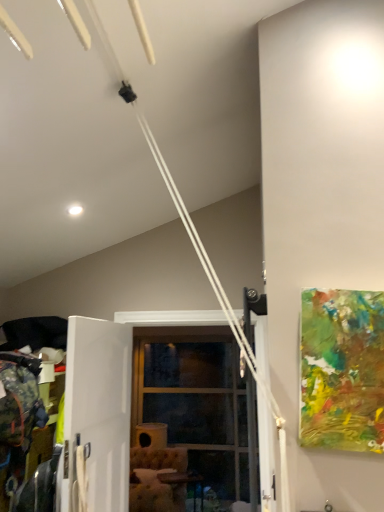
What do you see at coordinates (183, 481) in the screenshot?
I see `wooden table at lower center` at bounding box center [183, 481].

The image size is (384, 512). Find the location of `white matte screen door at center`. white matte screen door at center is located at coordinates (98, 411).

From the picture: Measure the distance between point (x=103, y=475) and camera.

Point (x=103, y=475) is 6.77 feet from camera.

Where is `wooden table at lower center`? This screenshot has width=384, height=512. wooden table at lower center is located at coordinates tap(183, 481).

Can you confirm if wooden table at lower center is taller than white matte screen door at center?

Incorrect, the height of wooden table at lower center is not larger of that of white matte screen door at center.

Is wooden table at lower center to the right of white matte screen door at center from the viewer's perspective?

Correct, you'll find wooden table at lower center to the right of white matte screen door at center.

Can you confirm if wooden table at lower center is thinner than white matte screen door at center?

No.

Is white matte screen door at center completely or partially inside wooden table at lower center?

Definitely not — white matte screen door at center is not inside wooden table at lower center.

Which object is more forward, clear glass door at center or abstract painting at right?

abstract painting at right is closer to the camera.

Is clear glass door at center bigger or smaller than abstract painting at right?

In the image, clear glass door at center appears to be larger than abstract painting at right.

Is clear glass door at center looking in the opposite direction of abstract painting at right?

No, clear glass door at center is not facing the opposite direction of abstract painting at right.

Is abstract painting at right far away from wooden table at lower center?

Yes, abstract painting at right and wooden table at lower center are located far from each other.

Is abstract painting at right not inside wooden table at lower center?

abstract painting at right is positioned outside wooden table at lower center.

Which of these two, abstract painting at right or wooden table at lower center, is thinner?

abstract painting at right.

Between abstract painting at right and wooden table at lower center, which one has less height?

Standing shorter between the two is abstract painting at right.

Is abstract painting at right spatially inside white matte screen door at center, or outside of it?

abstract painting at right is not enclosed by white matte screen door at center.

This screenshot has height=512, width=384. I want to click on screen door that is under the abstract painting at right (from a real-world perspective), so click(98, 411).

Is abstract painting at right bigger than white matte screen door at center?

Incorrect, abstract painting at right is not larger than white matte screen door at center.

Is abstract painting at right behind white matte screen door at center?

No, abstract painting at right is in front of white matte screen door at center.

Is abstract painting at right situated inside clear glass door at center or outside?

The correct answer is: outside.

Which object is thinner, abstract painting at right or clear glass door at center?

abstract painting at right is thinner.

Where is `picture frame in front of the clear glass door at center`? The width and height of the screenshot is (384, 512). picture frame in front of the clear glass door at center is located at coordinates (342, 370).

Which object is positioned more to the right, abstract painting at right or clear glass door at center?

From the viewer's perspective, abstract painting at right appears more on the right side.

Between point (117, 451) and point (132, 401), which one is positioned in front?

The point (117, 451) is in front.

Is white matte screen door at center touching clear glass door at center?

No, white matte screen door at center is not with clear glass door at center.

From their relative heights in the image, would you say white matte screen door at center is taller or shorter than clear glass door at center?

Clearly, white matte screen door at center is shorter compared to clear glass door at center.

From the image's perspective, relative to clear glass door at center, is white matte screen door at center above or below?

Clearly, from the image's perspective, white matte screen door at center is above clear glass door at center.

Is clear glass door at center outside of white matte screen door at center?

Yes, clear glass door at center is not within white matte screen door at center.

Considering the sizes of objects clear glass door at center and white matte screen door at center in the image provided, who is shorter, clear glass door at center or white matte screen door at center?

white matte screen door at center is shorter.

Consider the image. How far apart are clear glass door at center and white matte screen door at center?

clear glass door at center is 2.21 meters from white matte screen door at center.

Identify the location of glass door on the right of the white matte screen door at center. This screenshot has width=384, height=512. (196, 402).

This screenshot has height=512, width=384. Identify the location of table that appears on the right of white matte screen door at center. (183, 481).

Locate an element on the screen. glass door that is below the abstract painting at right (from the image's perspective) is located at coordinates (196, 402).

Estimate the real-world distances between objects in this image. Which object is closer to clear glass door at center, wooden table at lower center or abstract painting at right?

wooden table at lower center is positioned closer to the anchor clear glass door at center.

When comparing their distances from clear glass door at center, does abstract painting at right or white matte screen door at center seem closer?

Based on the image, white matte screen door at center appears to be nearer to clear glass door at center.

Which object lies further to the anchor point wooden table at lower center, clear glass door at center or abstract painting at right?

abstract painting at right lies further to wooden table at lower center than the other object.

Considering their positions, is wooden table at lower center positioned closer to clear glass door at center than white matte screen door at center?

wooden table at lower center is positioned closer to the anchor clear glass door at center.

When comparing their distances from clear glass door at center, does white matte screen door at center or wooden table at lower center seem further?

The object further to clear glass door at center is white matte screen door at center.

Considering their positions, is clear glass door at center positioned closer to abstract painting at right than wooden table at lower center?

clear glass door at center.

Looking at the image, which one is located further to white matte screen door at center, wooden table at lower center or abstract painting at right?

wooden table at lower center.

From the image, which object appears to be nearer to abstract painting at right, wooden table at lower center or white matte screen door at center?

white matte screen door at center is positioned closer to the anchor abstract painting at right.

Locate an element on the screen. The height and width of the screenshot is (512, 384). screen door between abstract painting at right and wooden table at lower center from front to back is located at coordinates (98, 411).

Where is `glass door between abstract painting at right and wooden table at lower center along the z-axis`? The width and height of the screenshot is (384, 512). glass door between abstract painting at right and wooden table at lower center along the z-axis is located at coordinates (196, 402).

I want to click on glass door between white matte screen door at center and wooden table at lower center along the z-axis, so click(196, 402).

Identify the location of screen door between abstract painting at right and clear glass door at center in the front-back direction. (98, 411).